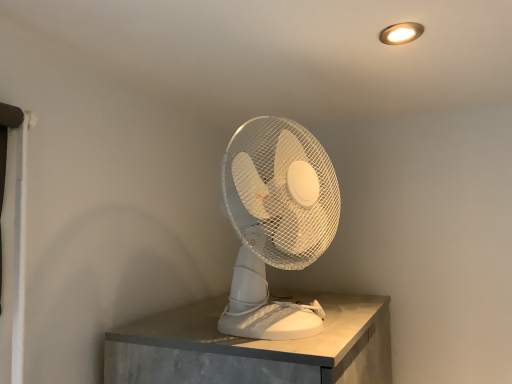
Question: Considering the positions of point (297, 221) and point (413, 34), is point (297, 221) closer or farther from the camera than point (413, 34)?

Choices:
 (A) closer
 (B) farther

Answer: (B)

Question: Considering the positions of white plastic fan at center and matte gold light fixture at upper right in the image, is white plastic fan at center bigger or smaller than matte gold light fixture at upper right?

Choices:
 (A) small
 (B) big

Answer: (B)

Question: In terms of height, does white plastic fan at center look taller or shorter compared to matte gold light fixture at upper right?

Choices:
 (A) short
 (B) tall

Answer: (B)

Question: From the image's perspective, is matte gold light fixture at upper right above or below white plastic fan at center?

Choices:
 (A) above
 (B) below

Answer: (A)

Question: Considering their positions, is matte gold light fixture at upper right located in front of or behind white plastic fan at center?

Choices:
 (A) behind
 (B) front

Answer: (A)

Question: In terms of height, does matte gold light fixture at upper right look taller or shorter compared to white plastic fan at center?

Choices:
 (A) short
 (B) tall

Answer: (A)

Question: Looking at the image, does matte gold light fixture at upper right seem bigger or smaller compared to white plastic fan at center?

Choices:
 (A) small
 (B) big

Answer: (A)